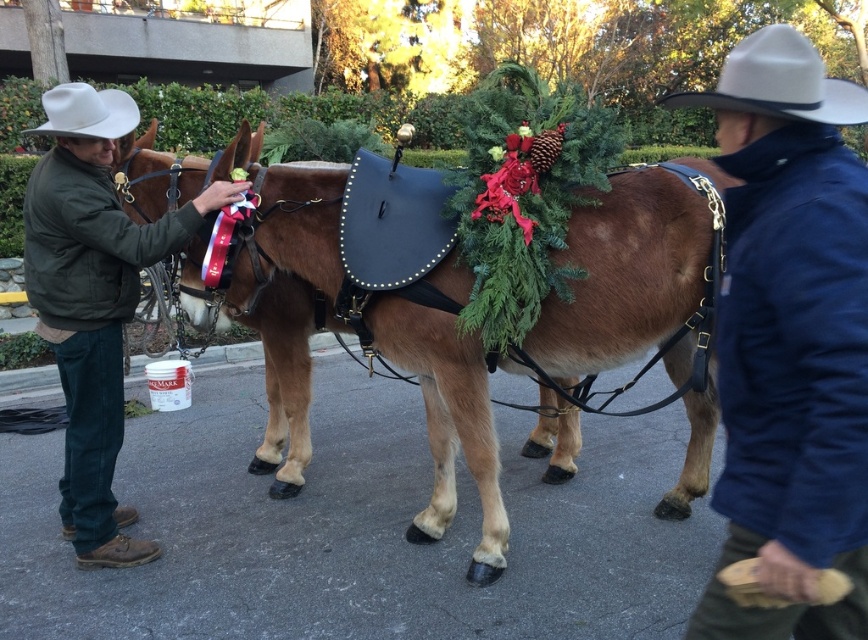
You are a photographer trying to capture a group photo of the two people in the scene. The camera you are using has a maximum focus range of 8 feet. Can both the blue woolen jacket at right and green cotton jacket at left be in focus simultaneously?

The blue woolen jacket at right and green cotton jacket at left are 8.65 feet apart. Since the camera has a maximum focus range of 8 feet, they are slightly out of the camera range, so both cannot be in focus at the same time.

From the picture: You are a tailor who needs to determine which jacket, the blue woolen jacket at right or the green cotton jacket at left, requires more fabric for alterations. Based on their sizes, which one would need more fabric?

The green cotton jacket at left requires more fabric for alterations because it is larger than the blue woolen jacket at right.

You are standing at the center of the image and want to hand a tool to the person wearing the blue woolen jacket at right. In which direction should you move relative to your current position to reach them?

The blue woolen jacket at right is located at point 0.533 on the x and 0.910 on the y coordinate. Since you are at the center, you should move to the right and slightly upwards to reach the person wearing the blue woolen jacket at right.